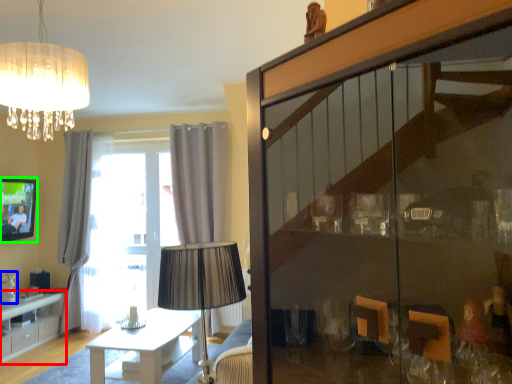
Question: Considering the real-world distances, which object is closest to cabinetry (highlighted by a red box)? glass vase (highlighted by a blue box) or picture frame (highlighted by a green box).

Choices:
 (A) glass vase
 (B) picture frame

Answer: (A)